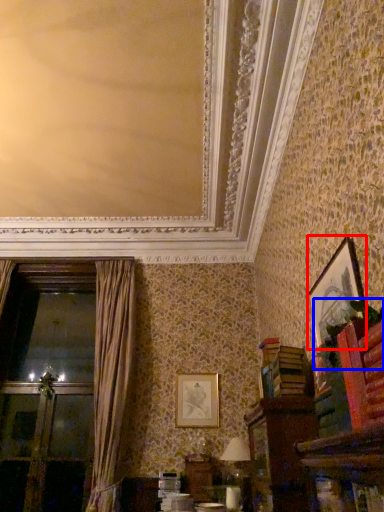
Question: Which object appears closest to the camera in this image, picture frame (highlighted by a red box) or plant (highlighted by a blue box)?

Choices:
 (A) picture frame
 (B) plant

Answer: (B)